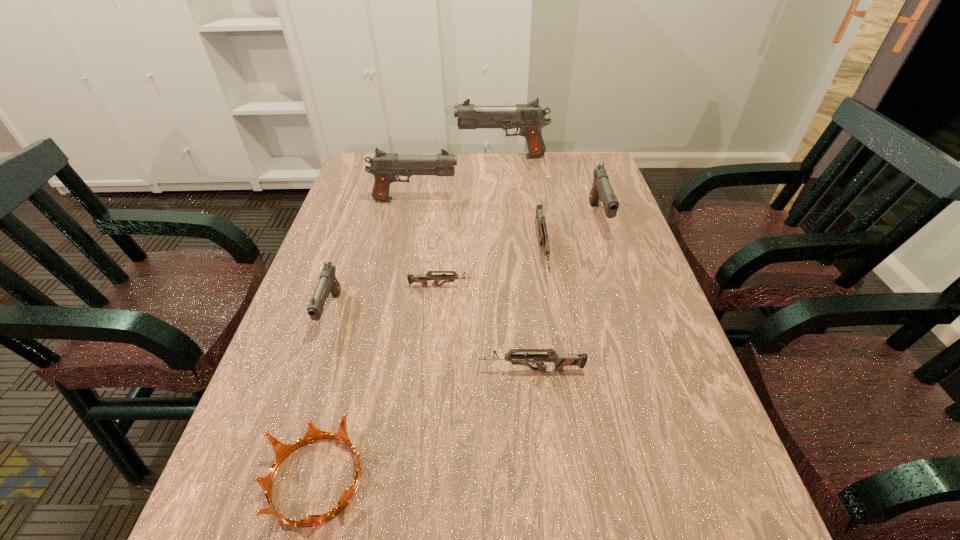
You are a GUI agent. You are given a task and a screenshot of the screen. Output one action in this format:
    pyautogui.click(x=<x>, y=<y>)
    Task: Click on the crown
    This screenshot has width=960, height=540.
    Given the screenshot: What is the action you would take?
    pyautogui.click(x=281, y=450)

You are a GUI agent. You are given a task and a screenshot of the screen. Output one action in this format:
    pyautogui.click(x=<x>, y=<y>)
    Task: Click on the nearest grey gun
    
    Given the screenshot: What is the action you would take?
    pyautogui.click(x=560, y=360)

Image resolution: width=960 pixels, height=540 pixels. I want to click on the sixth tallest gun, so [560, 360].

Identify the location of the shortest object. (423, 279).

Find the location of `the leftmost grey gun`. the leftmost grey gun is located at coordinates click(423, 279).

The image size is (960, 540). I want to click on vacant space situated in the direction the biggest gray gun is aimed, so (408, 157).

The width and height of the screenshot is (960, 540). What are the coordinates of `vacant area located in the direction the biggest gray gun is aimed` in the screenshot? It's located at (386, 157).

You are a GUI agent. You are given a task and a screenshot of the screen. Output one action in this format:
    pyautogui.click(x=<x>, y=<y>)
    Task: Click on the free point located in the direction the biggest gray gun is aimed
    
    Given the screenshot: What is the action you would take?
    pyautogui.click(x=395, y=157)

What are the coordinates of `free spot located in the direction the third smallest gray gun is aimed` in the screenshot? It's located at (588, 200).

Where is `vacant space located 0.220m in the direction the sixth shortest object is aimed`? Image resolution: width=960 pixels, height=540 pixels. vacant space located 0.220m in the direction the sixth shortest object is aimed is located at coordinates click(625, 298).